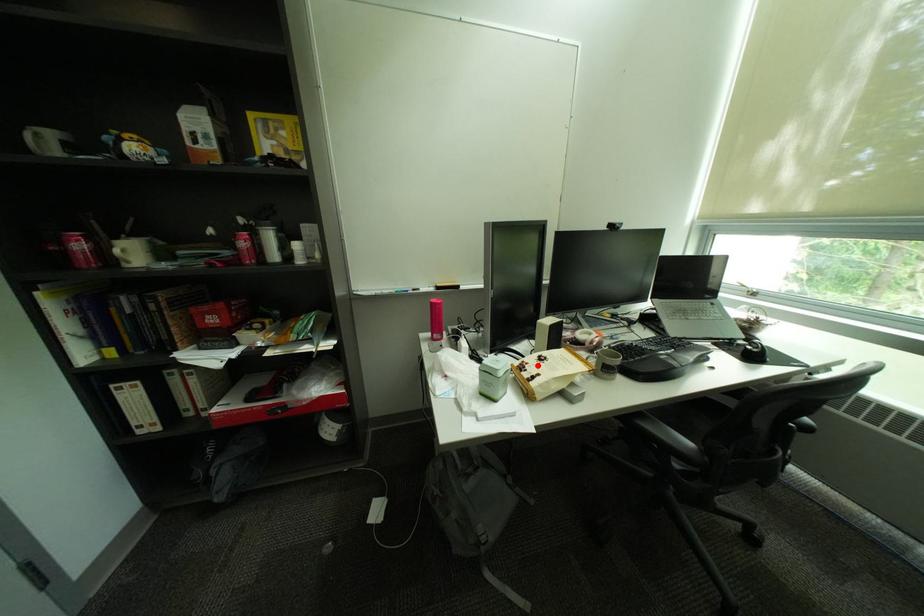
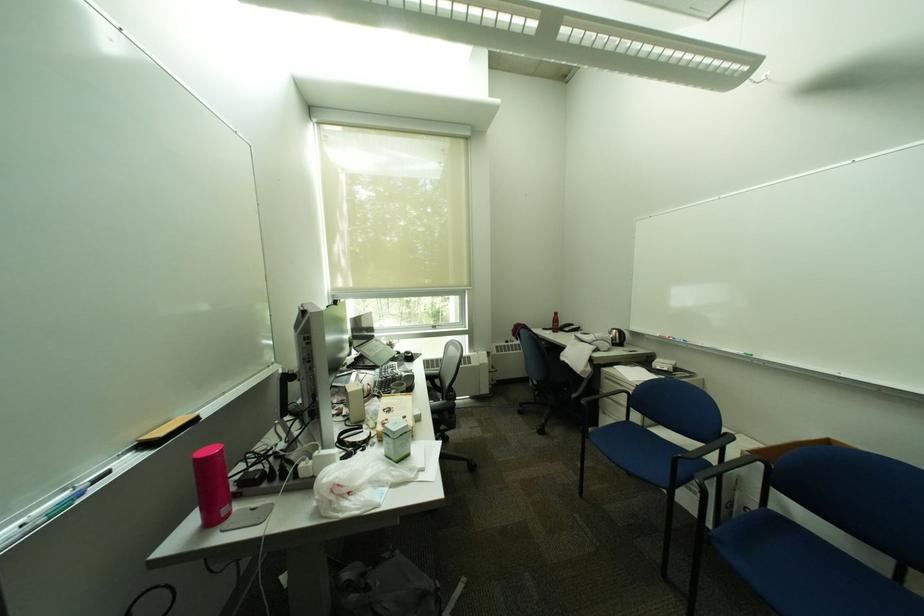
Find the pixel in the second image that matches the highlighted location in the first image.

(397, 421)